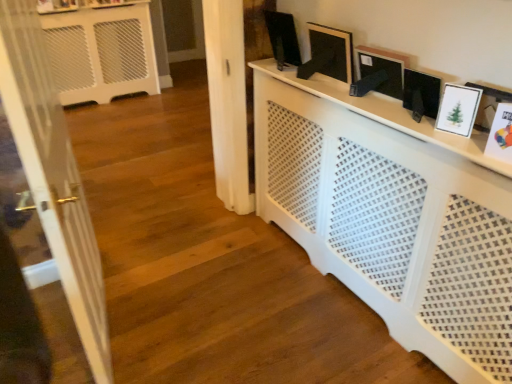
Question: Is white paper picture frame at right, positioned as the first picture frame in right-to-left order, surrounded by white glossy picture frame at upper right, which is counted as the second picture frame, starting from the right?

Choices:
 (A) no
 (B) yes

Answer: (A)

Question: Is white glossy picture frame at upper right, which is counted as the second picture frame, starting from the right, positioned beyond the bounds of white paper picture frame at right, which is the first picture frame in front-to-back order?

Choices:
 (A) no
 (B) yes

Answer: (B)

Question: Can you confirm if white glossy picture frame at upper right, which is the fourth picture frame in back-to-front order, is bigger than white paper picture frame at right, which is the first picture frame in front-to-back order?

Choices:
 (A) yes
 (B) no

Answer: (B)

Question: Considering the relative positions of white glossy picture frame at upper right, which is the 2th picture frame from front to back, and white paper picture frame at right, which is counted as the fifth picture frame, starting from the left, in the image provided, is white glossy picture frame at upper right, which is the 2th picture frame from front to back, in front of white paper picture frame at right, which is counted as the fifth picture frame, starting from the left,?

Choices:
 (A) no
 (B) yes

Answer: (A)

Question: From a real-world perspective, is white glossy picture frame at upper right, which is the 2th picture frame from front to back, below white paper picture frame at right, positioned as the first picture frame in right-to-left order?

Choices:
 (A) yes
 (B) no

Answer: (A)

Question: Is white glossy picture frame at upper right, which is the fourth picture frame in back-to-front order, spatially inside white perforated radiator at center, or outside of it?

Choices:
 (A) inside
 (B) outside

Answer: (B)

Question: Looking at the image, does white glossy picture frame at upper right, which is counted as the second picture frame, starting from the right, seem bigger or smaller compared to white perforated radiator at center?

Choices:
 (A) small
 (B) big

Answer: (A)

Question: From the image's perspective, is white glossy picture frame at upper right, which is the fourth picture frame in back-to-front order, above or below white perforated radiator at center?

Choices:
 (A) below
 (B) above

Answer: (B)

Question: Considering the relative positions of white glossy picture frame at upper right, the 4th picture frame from the left, and white perforated radiator at center in the image provided, is white glossy picture frame at upper right, the 4th picture frame from the left, to the left or to the right of white perforated radiator at center?

Choices:
 (A) left
 (B) right

Answer: (B)

Question: Is black matte picture frame at upper center, which is the second picture frame from left to right, taller or shorter than white paper picture frame at right, which is the fifth picture frame from back to front?

Choices:
 (A) short
 (B) tall

Answer: (B)

Question: In terms of size, does black matte picture frame at upper center, placed as the fourth picture frame when sorted from right to left, appear bigger or smaller than white paper picture frame at right, which is the fifth picture frame from back to front?

Choices:
 (A) big
 (B) small

Answer: (A)

Question: Considering the positions of point (338, 59) and point (485, 142), is point (338, 59) closer or farther from the camera than point (485, 142)?

Choices:
 (A) closer
 (B) farther

Answer: (B)

Question: Is black matte picture frame at upper center, which is counted as the 4th picture frame, starting from the front, in front of or behind white paper picture frame at right, which is the fifth picture frame from back to front, in the image?

Choices:
 (A) front
 (B) behind

Answer: (B)

Question: Looking at the image, does matte black picture frame at upper center, the first picture frame when ordered from left to right, seem bigger or smaller compared to white glossy picture frame at upper right, which is the 2th picture frame from front to back?

Choices:
 (A) small
 (B) big

Answer: (B)

Question: Considering their positions, is matte black picture frame at upper center, placed as the fifth picture frame when sorted from right to left, located in front of or behind white glossy picture frame at upper right, which is the fourth picture frame in back-to-front order?

Choices:
 (A) front
 (B) behind

Answer: (B)